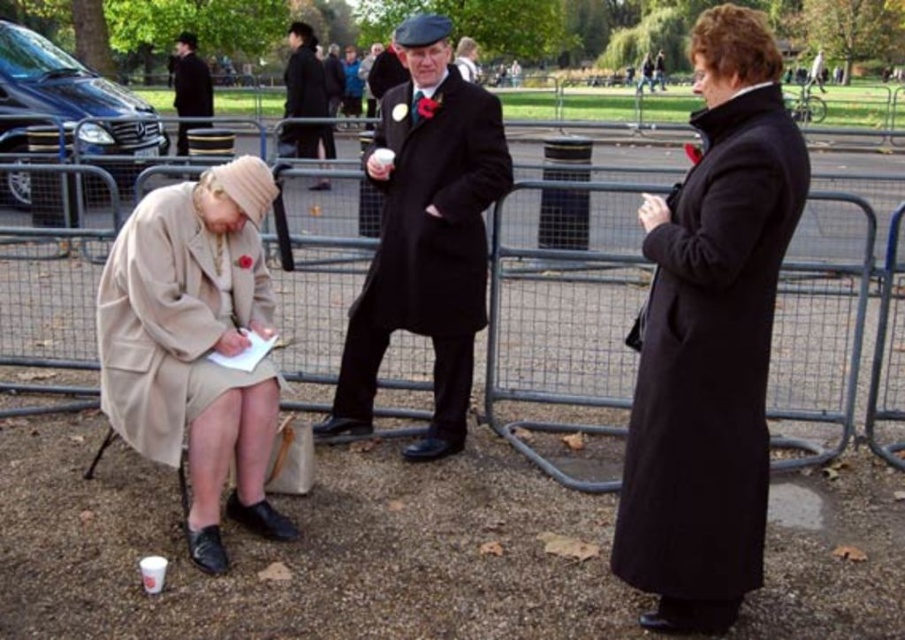
Question: Which point is closer to the camera?

Choices:
 (A) beige woolen coat at lower left
 (B) matte black coat at center

Answer: (A)

Question: Which object appears farthest from the camera in this image?

Choices:
 (A) black wool coat at center
 (B) black wool coat at right
 (C) black wool coat at upper left
 (D) beige woolen coat at lower left

Answer: (C)

Question: Can you confirm if black wool coat at right is bigger than beige woolen coat at lower left?

Choices:
 (A) yes
 (B) no

Answer: (A)

Question: Does metal fence at center lie behind matte black coat at center?

Choices:
 (A) no
 (B) yes

Answer: (B)

Question: Is matte black coat at center smaller than black wool coat at upper left?

Choices:
 (A) yes
 (B) no

Answer: (A)

Question: Estimate the real-world distances between objects in this image. Which object is farther from the beige woolen coat at lower left?

Choices:
 (A) matte black coat at center
 (B) black wool coat at center
 (C) black wool coat at right

Answer: (B)